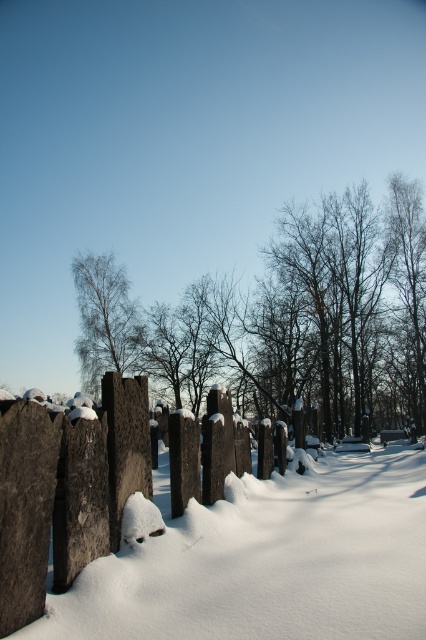
You are standing in the cemetery and want to walk from the dark gray stone fence at center to the bare birch tree at center. Which direction should you face to walk directly towards it?

You should face to the left to walk directly towards the bare birch tree at center from the dark gray stone fence at center because the dark gray stone fence at center is to the right of the bare birch tree at center.

Consider the image. You are a visitor at the cemetery and want to take a photo of the dark gray stone fence at center and the bare birch tree at center. Which object should you focus on first to ensure both are in the frame?

The dark gray stone fence at center is positioned under the bare birch tree at center, so you should focus on the bare birch tree at center first to ensure both are in the frame.